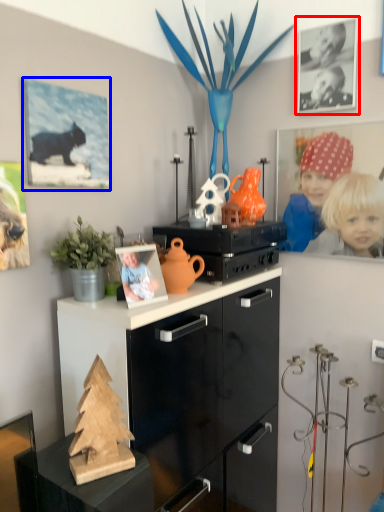
Question: Which point is further to the camera, picture frame (highlighted by a red box) or picture frame (highlighted by a blue box)?

Choices:
 (A) picture frame
 (B) picture frame

Answer: (A)